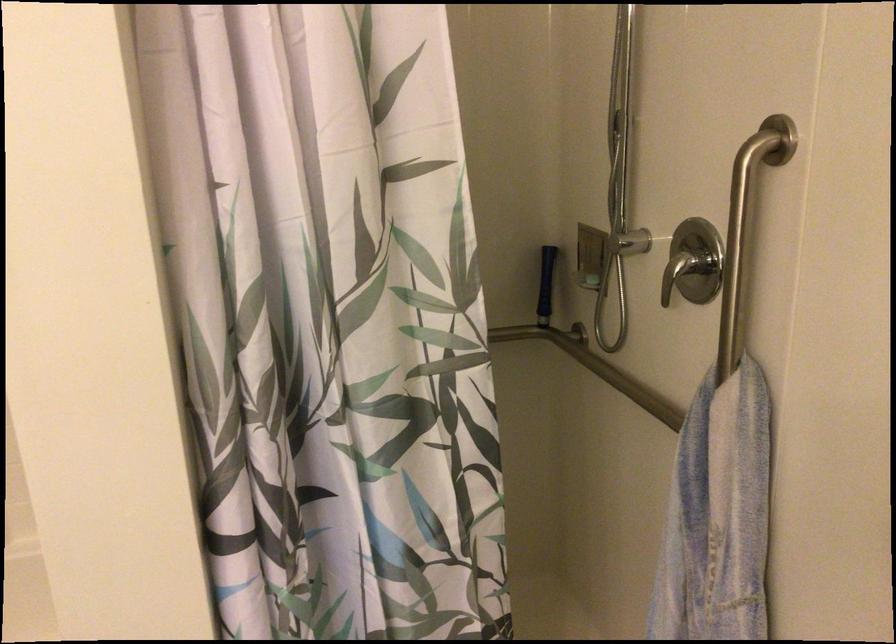
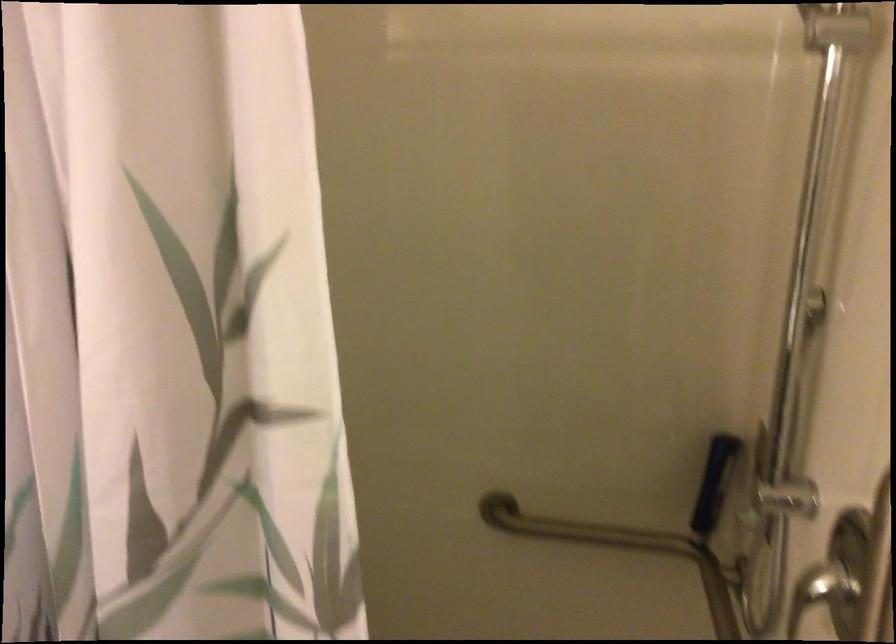
Which direction would the cameraman need to move to produce the second image?

The cameraman walked toward right, forward.